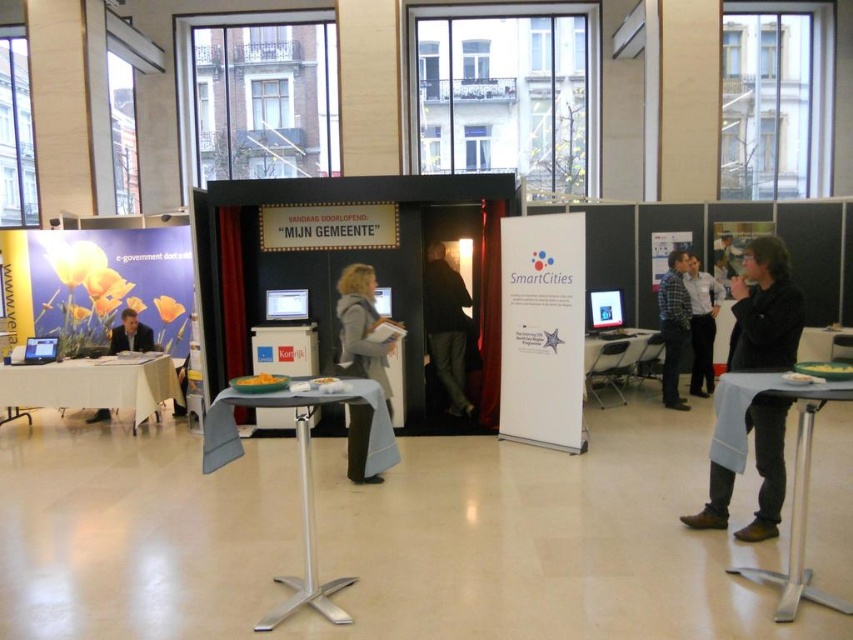
You are at the event and see the dark gray sweater at right and the matte black jacket at left. Which clothing item is located below the other?

The dark gray sweater at right is positioned under the matte black jacket at left.

You are at the event and need to decide which clothing item to wear for a presentation. Considering the height of the dark gray sweater at right and the matte black jacket at left, which one would you choose if you want to appear taller?

The dark gray sweater at right is taller than the matte black jacket at left, so choosing the dark gray sweater at right would help you appear taller.